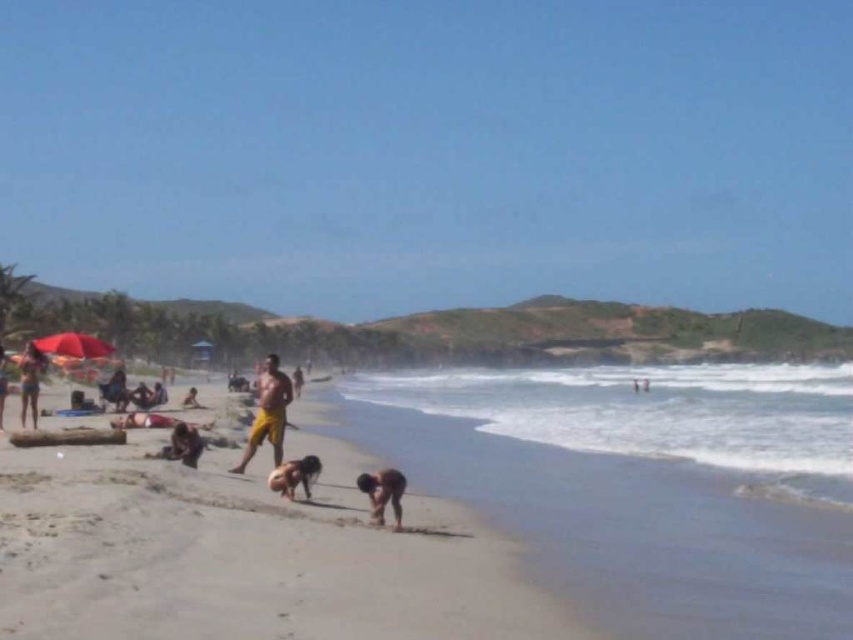
You are a photographer trying to capture a closeup of the yellow matte shorts at center and the dark brown skin at lower center. Since you want to focus on both subjects, which one should you zoom in on to ensure both are in frame?

The yellow matte shorts at center is wider than the dark brown skin at lower center, so you should zoom in on the yellow matte shorts at center to ensure both are in frame.

You are a photographer standing at the edge of the beach, wanting to capture a photo of both the yellow matte shorts at center and the yellow fabric person at center in the same frame. Given their distance apart, is it feasible to include both subjects in a single shot without moving your position?

The yellow matte shorts at center and yellow fabric person at center are 10.29 feet apart. Depending on the camera lens, this distance may require a wider angle lens to capture both in the same frame without moving. If your camera has a wide enough field of view, it should be possible.